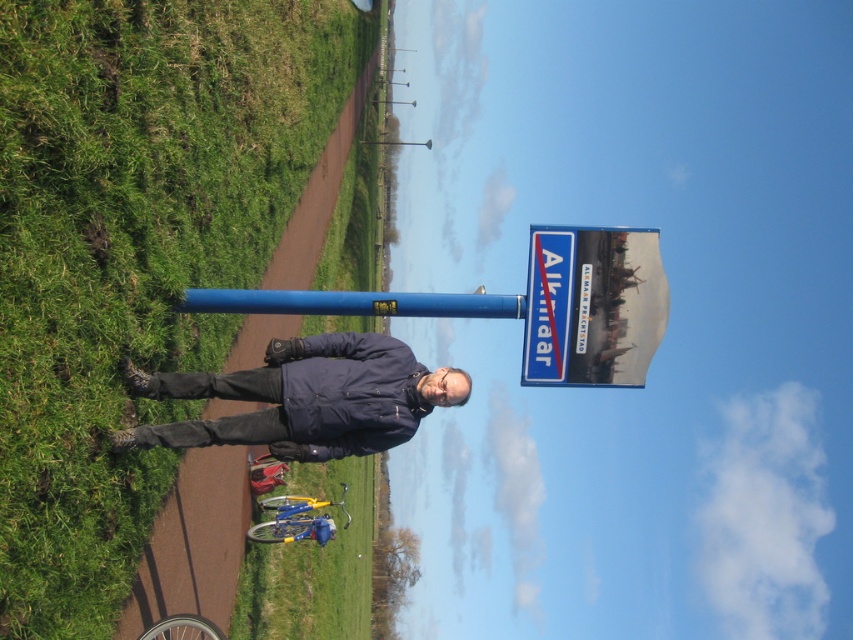
You are a photographer trying to capture the blue plastic sign at upper center in your shot. However, the green grass at lower left is blocking part of it. Can you adjust your position to avoid the grass and still include the sign?

The green grass at lower left is in front of the blue plastic sign at upper center, so moving your camera position slightly upward or backward might help to exclude the grass while keeping the sign in frame.

You are a photographer trying to capture the blue plastic sign at upper center and the dark blue jacket at center in the same frame. Which object should you focus on first to ensure both are in the frame without moving the camera?

Since the dark blue jacket at center is wider than the blue plastic sign at upper center, you should focus on the dark blue jacket at center first to ensure both fit within the frame.

You are standing on the dirt path and want to walk towards the blue metallic pole at center. Which direction should you move to avoid stepping on the green grass at lower left?

The green grass at lower left is in front of the blue metallic pole at center, so to avoid stepping on it, you should move to the right side of the blue metallic pole at center as you approach it.